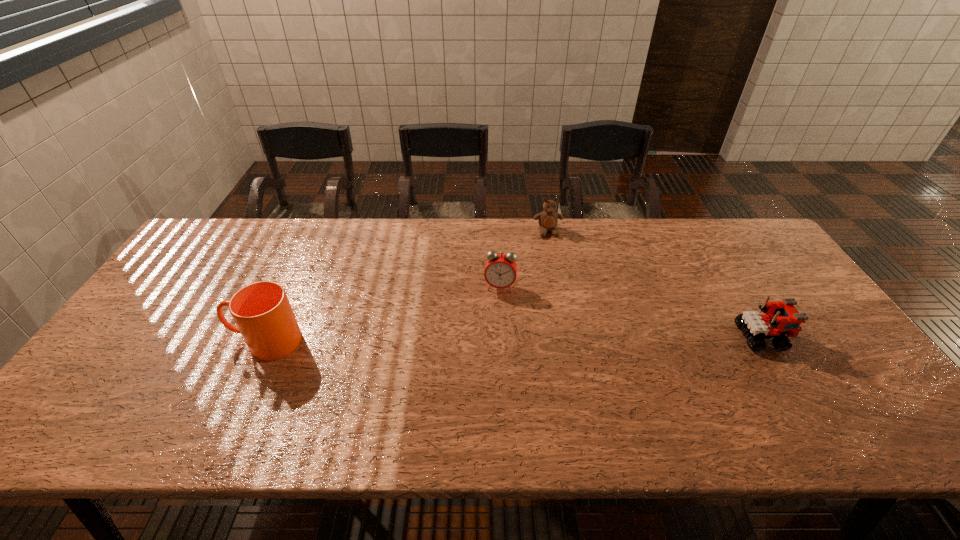
Locate an element on the screen. The width and height of the screenshot is (960, 540). free space located on the front-facing side of the rightmost object is located at coordinates (816, 338).

Image resolution: width=960 pixels, height=540 pixels. In order to click on vacant point located 0.170m on the front-facing side of the second farthest object in this screenshot , I will do tap(492, 339).

You are a GUI agent. You are given a task and a screenshot of the screen. Output one action in this format:
    pyautogui.click(x=<x>, y=<y>)
    Task: Click on the blank space located 0.070m on the front-facing side of the second farthest object
    The width and height of the screenshot is (960, 540).
    Given the screenshot: What is the action you would take?
    pyautogui.click(x=496, y=311)

Where is `vacant point located on the front-facing side of the second farthest object`? vacant point located on the front-facing side of the second farthest object is located at coordinates (490, 367).

Locate an element on the screen. blank area located 0.300m on the front-facing side of the second object from right to left is located at coordinates (566, 302).

Find the location of a particular element. vacant space located 0.240m on the front-facing side of the second object from right to left is located at coordinates (563, 288).

This screenshot has height=540, width=960. What are the coordinates of `free space located 0.400m on the front-facing side of the second object from right to left` in the screenshot? It's located at (573, 329).

I want to click on object positioned at the far edge, so click(x=548, y=219).

Locate an element on the screen. The width and height of the screenshot is (960, 540). object that is at the right edge is located at coordinates click(782, 318).

Where is `vacant position at the far edge of the desktop`? The image size is (960, 540). vacant position at the far edge of the desktop is located at coordinates (319, 243).